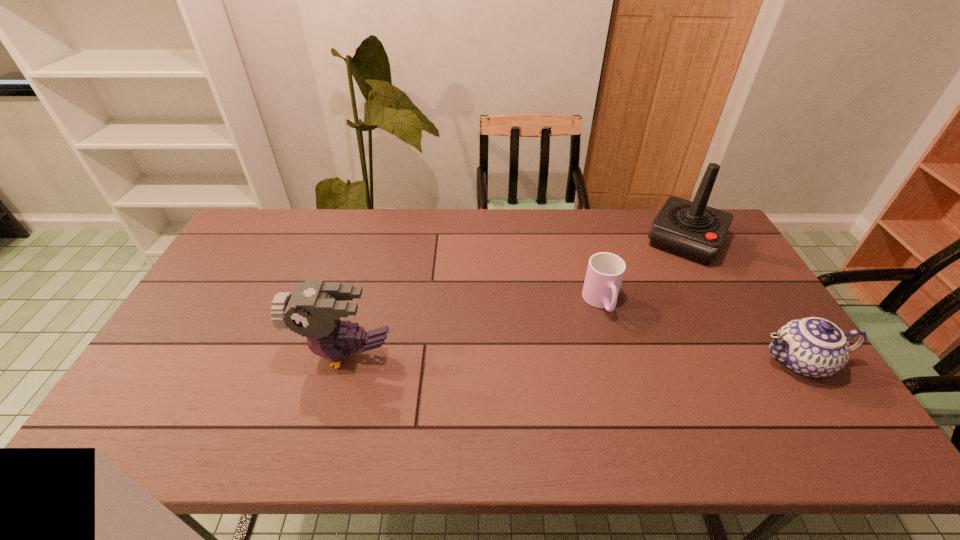
The image size is (960, 540). In order to click on the leftmost object in this screenshot , I will do `click(313, 310)`.

This screenshot has height=540, width=960. Identify the location of the second tallest object. (313, 310).

Identify the location of chinaware. This screenshot has width=960, height=540. (813, 347).

Where is `the third object from right to left`? This screenshot has height=540, width=960. the third object from right to left is located at coordinates (605, 271).

Locate an element on the screen. This screenshot has width=960, height=540. cup is located at coordinates (605, 271).

You are a GUI agent. You are given a task and a screenshot of the screen. Output one action in this format:
    pyautogui.click(x=<x>, y=<y>)
    Task: Click on the farthest object
    This screenshot has height=540, width=960.
    Given the screenshot: What is the action you would take?
    pyautogui.click(x=692, y=230)

Find the location of a particular element. This screenshot has height=540, width=960. joystick is located at coordinates (692, 230).

I want to click on free location located 0.090m at the beak of the leftmost object, so click(265, 354).

Locate an element on the screen. Image resolution: width=960 pixels, height=540 pixels. free region located at the beak of the leftmost object is located at coordinates (172, 354).

The width and height of the screenshot is (960, 540). What are the coordinates of `free region located at the beak of the leftmost object` in the screenshot? It's located at (224, 354).